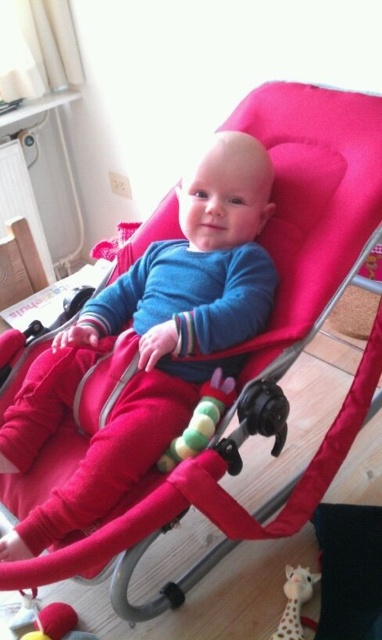
Question: Among these objects, which one is nearest to the camera?

Choices:
 (A) soft plush giraffe at lower center
 (B) soft plush toy at lower left

Answer: (B)

Question: Does soft plush giraffe at lower center come in front of soft plush toy at lower left?

Choices:
 (A) yes
 (B) no

Answer: (B)

Question: From the image, what is the correct spatial relationship of soft plush giraffe at lower center in relation to soft plush toy at lower left?

Choices:
 (A) above
 (B) below

Answer: (A)

Question: Is soft plush giraffe at lower center thinner than soft plush toy at lower left?

Choices:
 (A) yes
 (B) no

Answer: (A)

Question: Among these objects, which one is nearest to the camera?

Choices:
 (A) soft plush giraffe at lower center
 (B) soft plush toy at lower left

Answer: (B)